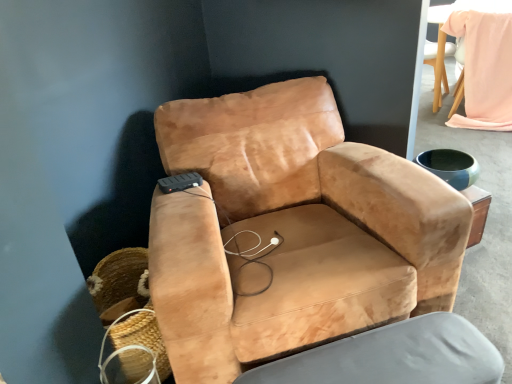
Question: Considering the relative sizes of suede tan armchair at center and light pink fabric bean bag chair at upper right in the image provided, is suede tan armchair at center wider than light pink fabric bean bag chair at upper right?

Choices:
 (A) no
 (B) yes

Answer: (B)

Question: Can you confirm if suede tan armchair at center is positioned to the left of light pink fabric bean bag chair at upper right?

Choices:
 (A) no
 (B) yes

Answer: (B)

Question: Does suede tan armchair at center have a greater height compared to light pink fabric bean bag chair at upper right?

Choices:
 (A) no
 (B) yes

Answer: (B)

Question: Considering the relative sizes of suede tan armchair at center and light pink fabric bean bag chair at upper right in the image provided, is suede tan armchair at center smaller than light pink fabric bean bag chair at upper right?

Choices:
 (A) no
 (B) yes

Answer: (A)

Question: Is suede tan armchair at center completely or partially outside of light pink fabric bean bag chair at upper right?

Choices:
 (A) yes
 (B) no

Answer: (A)

Question: From the image's perspective, is suede tan armchair at center located beneath light pink fabric bean bag chair at upper right?

Choices:
 (A) no
 (B) yes

Answer: (B)

Question: Does light pink fabric bean bag chair at upper right have a lesser width compared to suede-like tan swivel chair at center?

Choices:
 (A) yes
 (B) no

Answer: (B)

Question: Is suede-like tan swivel chair at center a part of light pink fabric bean bag chair at upper right?

Choices:
 (A) no
 (B) yes

Answer: (A)

Question: From the image's perspective, is light pink fabric bean bag chair at upper right beneath suede-like tan swivel chair at center?

Choices:
 (A) no
 (B) yes

Answer: (A)

Question: Is light pink fabric bean bag chair at upper right far from suede-like tan swivel chair at center?

Choices:
 (A) no
 (B) yes

Answer: (B)

Question: Can you confirm if light pink fabric bean bag chair at upper right is shorter than suede-like tan swivel chair at center?

Choices:
 (A) no
 (B) yes

Answer: (A)

Question: Does light pink fabric bean bag chair at upper right lie behind suede-like tan swivel chair at center?

Choices:
 (A) yes
 (B) no

Answer: (A)

Question: Would you say woven straw basket at lower left contains light pink fabric bean bag chair at upper right?

Choices:
 (A) no
 (B) yes

Answer: (A)